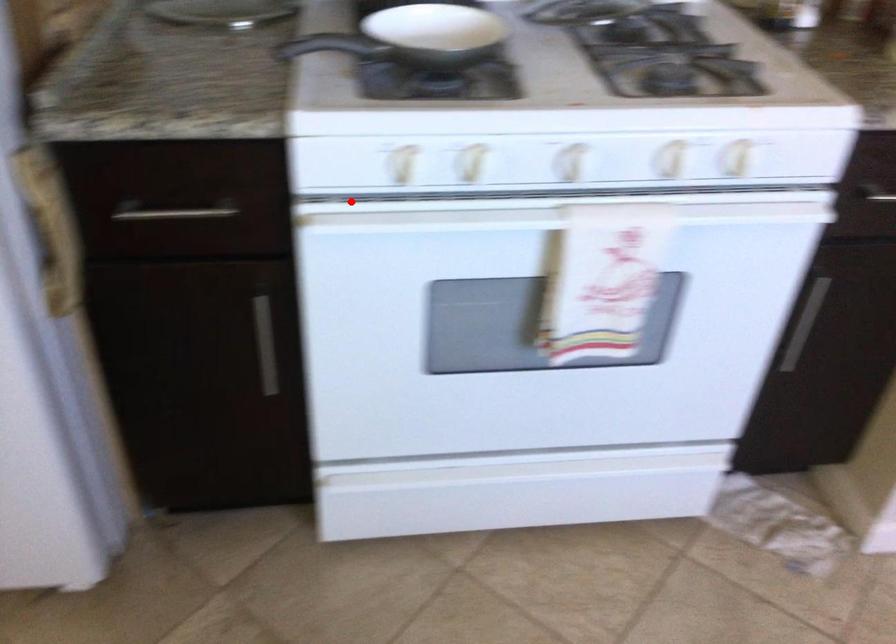
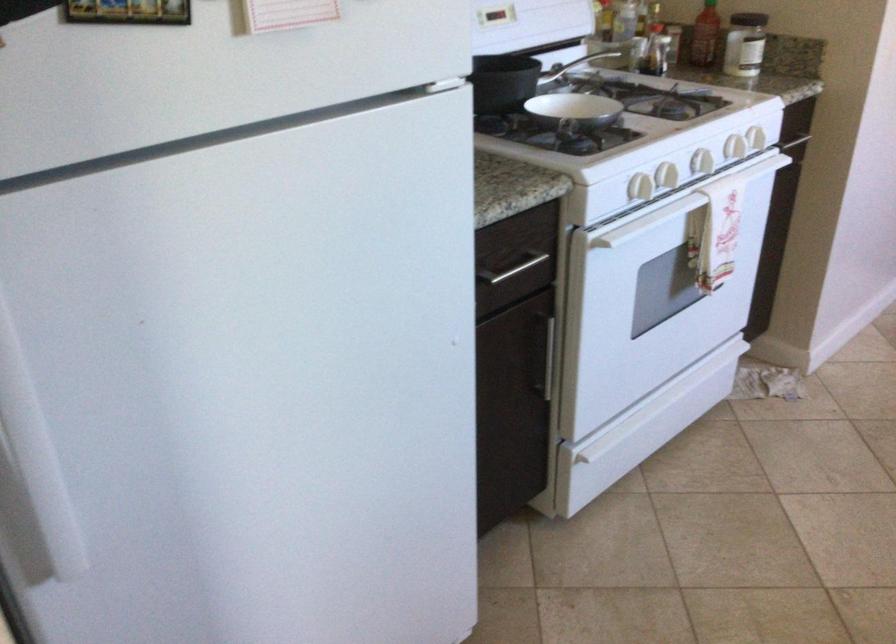
Question: I am providing you with two images of the same scene from different viewpoints. Given a red point in image1, look at the same physical point in image2. Is it:

Choices:
 (A) Closer to the viewpoint
 (B) Farther from the viewpoint

Answer: (B)